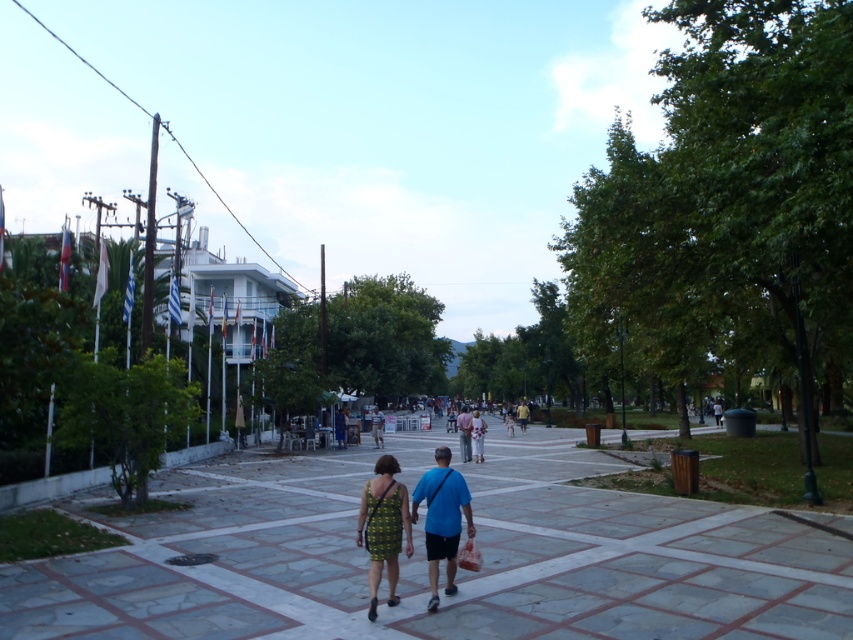
Looking at this image, you are a photographer standing at the edge of the walkway. You want to capture a photo that includes both the gray stone pavement at center and the blue fabric bag at center. Which object should you focus on first to ensure both are in frame?

The gray stone pavement at center is taller than the blue fabric bag at center, so you should focus on the gray stone pavement at center first to ensure both are in frame.

You are standing at the point closer to the camera in the image. There are two points marked in the scene, one at point coordinates (466, 433) and another at (476, 460). Which point are you standing at?

You are standing at point coordinates (466, 433) because it is closer to the camera than point coordinates (476, 460).

You are standing on the pedestrian walkway and see two dresses at the center of the image. Which one is closer to you, the floral fabric dress at center or the floral dress at center?

The floral fabric dress at center is closer to you because it is further to the viewer than the floral dress at center.